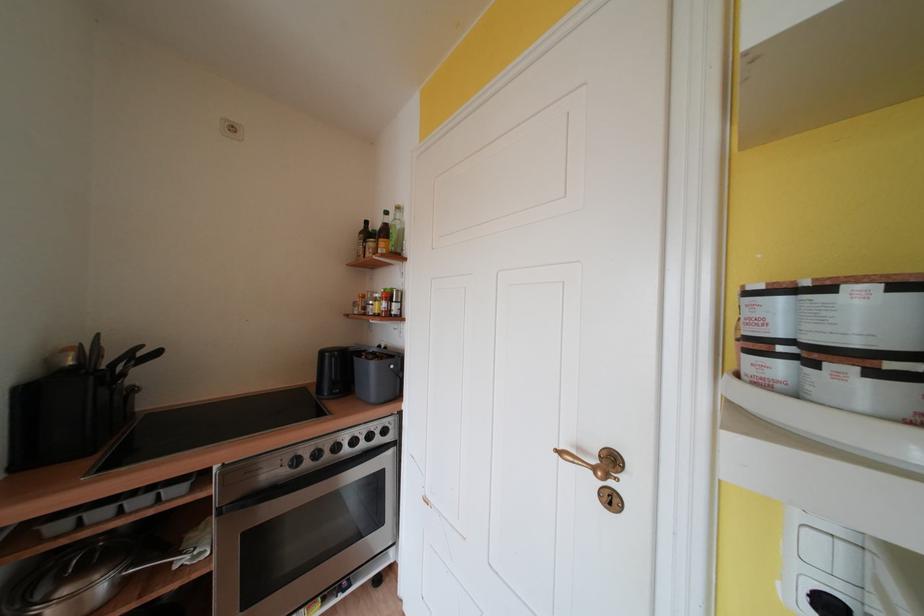
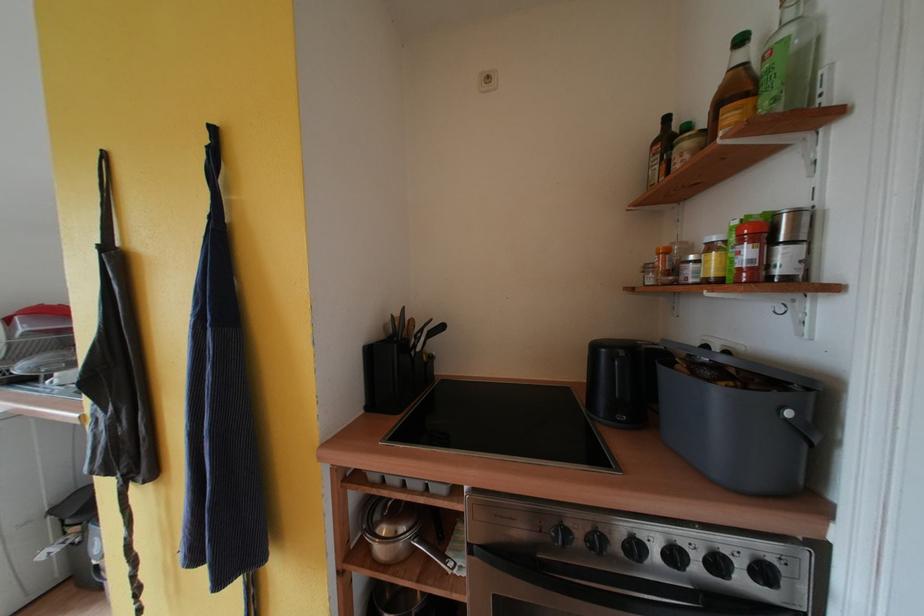
In the second image, find the point that corresponds to point (343, 451) in the first image.

(641, 551)